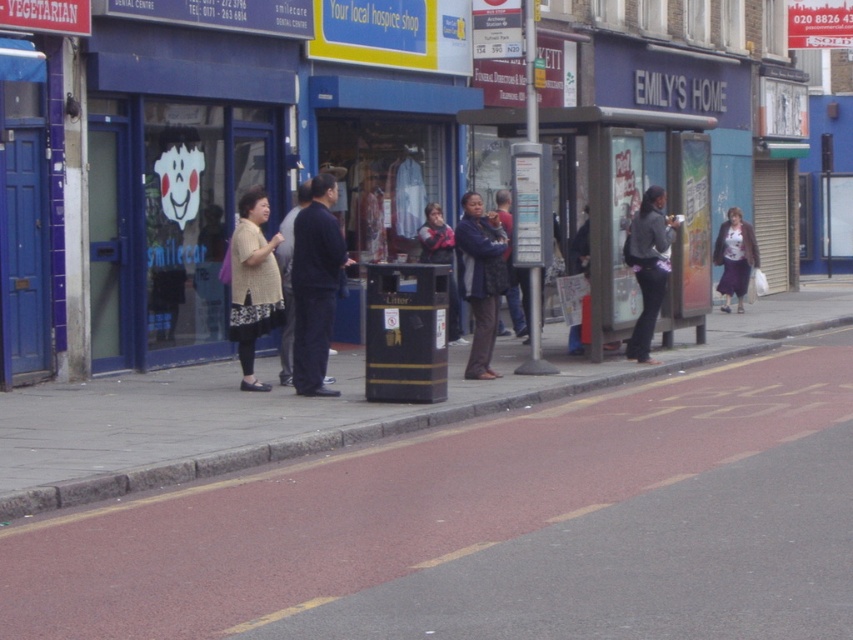
You are a delivery person carrying a package and need to place it on the ground near the dark blue textured coat at center. Where should you put it so that it doesn not block the concrete sidewalk at lower left?

Place the package behind the dark blue textured coat at center, as the concrete sidewalk at lower left is in front of the dark blue textured coat at center, so placing it behind would keep the sidewalk clear.

You are standing at the camera position and want to pick up the knitted beige sweater at center. Is it within your immediate reach?

The knitted beige sweater at center is 46.96 feet away from the camera, so it is too far to reach immediately. You would need to move closer.